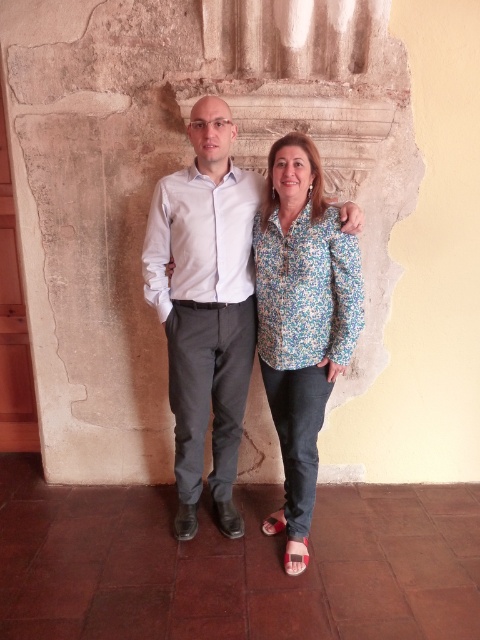
What do you see at coordinates (301, 310) in the screenshot? Image resolution: width=480 pixels, height=640 pixels. I see `floral print blouse at center` at bounding box center [301, 310].

Does floral print blouse at center have a lesser width compared to red fabric sandal at lower center?

Incorrect, floral print blouse at center's width is not less than red fabric sandal at lower center's.

What do you see at coordinates (301, 310) in the screenshot? The height and width of the screenshot is (640, 480). I see `floral print blouse at center` at bounding box center [301, 310].

The width and height of the screenshot is (480, 640). What are the coordinates of `floral print blouse at center` in the screenshot? It's located at (301, 310).

Who is lower down, pink fabric sandal at lower center or red fabric sandal at lower center?

pink fabric sandal at lower center is lower down.

Image resolution: width=480 pixels, height=640 pixels. I want to click on pink fabric sandal at lower center, so click(x=296, y=556).

Can you confirm if floral print blouse at center is wider than pink fabric sandal at lower center?

Correct, the width of floral print blouse at center exceeds that of pink fabric sandal at lower center.

Who is shorter, floral print blouse at center or pink fabric sandal at lower center?

With less height is pink fabric sandal at lower center.

Which is in front, point (327, 236) or point (307, 554)?

Positioned in front is point (327, 236).

The image size is (480, 640). Find the location of `floral print blouse at center`. floral print blouse at center is located at coordinates (301, 310).